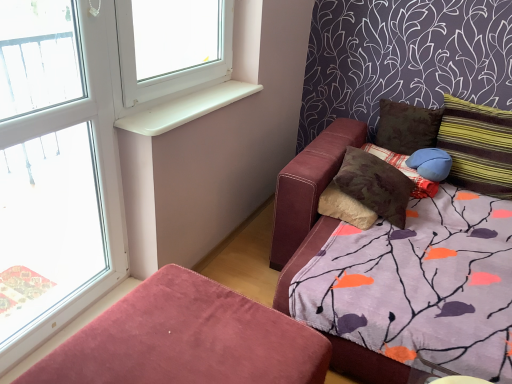
Question: Does white plastic window sill at upper left appear on the left side of clear glass window at left?

Choices:
 (A) yes
 (B) no

Answer: (B)

Question: From the image's perspective, is white plastic window sill at upper left located above clear glass window at left?

Choices:
 (A) no
 (B) yes

Answer: (B)

Question: From the image's perspective, would you say white plastic window sill at upper left is shown under clear glass window at left?

Choices:
 (A) no
 (B) yes

Answer: (A)

Question: Is white plastic window sill at upper left looking in the opposite direction of clear glass window at left?

Choices:
 (A) no
 (B) yes

Answer: (A)

Question: From a real-world perspective, is white plastic window sill at upper left on top of clear glass window at left?

Choices:
 (A) yes
 (B) no

Answer: (A)

Question: From a real-world perspective, is brown textured pillow at upper right, which is the fourth pillow from right to left, above or below brown fabric pillow at upper right, placed as the third pillow when sorted from right to left?

Choices:
 (A) below
 (B) above

Answer: (A)

Question: Is point (391, 162) closer or farther from the camera than point (384, 142)?

Choices:
 (A) farther
 (B) closer

Answer: (B)

Question: In terms of height, does brown textured pillow at upper right, acting as the 1th pillow starting from the left, look taller or shorter compared to brown fabric pillow at upper right, the 2th pillow viewed from the left?

Choices:
 (A) short
 (B) tall

Answer: (A)

Question: From the image's perspective, is brown textured pillow at upper right, acting as the 1th pillow starting from the left, positioned above or below brown fabric pillow at upper right, the 2th pillow viewed from the left?

Choices:
 (A) above
 (B) below

Answer: (B)

Question: From a real-world perspective, relative to brown textured pillow at upper right, acting as the 1th pillow starting from the left, is striped fabric pillow at right, the fourth pillow viewed from the left, vertically above or below?

Choices:
 (A) below
 (B) above

Answer: (B)

Question: Would you say striped fabric pillow at right, the fourth pillow viewed from the left, is to the left or to the right of brown textured pillow at upper right, which is the fourth pillow from right to left, in the picture?

Choices:
 (A) right
 (B) left

Answer: (A)

Question: Is point (490, 134) positioned closer to the camera than point (434, 192)?

Choices:
 (A) closer
 (B) farther

Answer: (B)

Question: Is striped fabric pillow at right, the fourth pillow viewed from the left, situated inside brown textured pillow at upper right, acting as the 1th pillow starting from the left, or outside?

Choices:
 (A) inside
 (B) outside

Answer: (B)

Question: In terms of height, does blue fabric pillow at upper right, placed as the 2th pillow when sorted from right to left, look taller or shorter compared to brown fabric pillow at upper right, placed as the third pillow when sorted from right to left?

Choices:
 (A) tall
 (B) short

Answer: (B)

Question: Is blue fabric pillow at upper right, placed as the 2th pillow when sorted from right to left, in front of or behind brown fabric pillow at upper right, the 2th pillow viewed from the left, in the image?

Choices:
 (A) behind
 (B) front

Answer: (B)